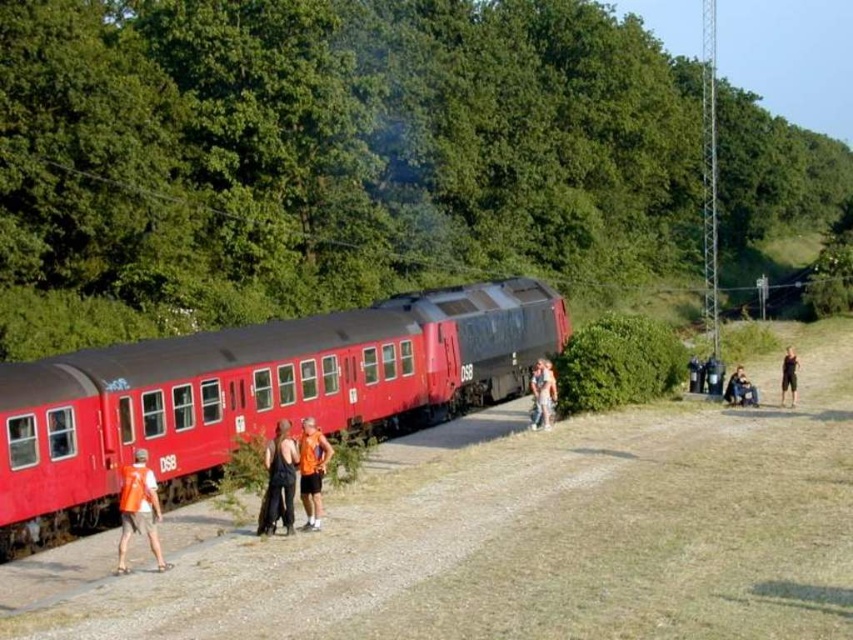
Question: Among these objects, which one is nearest to the camera?

Choices:
 (A) orange fabric shorts at center
 (B) matte red train at center
 (C) dirt track at lower left
 (D) black fabric shorts at right

Answer: (C)

Question: Is dirt track at lower left above matte black tank top at center?

Choices:
 (A) yes
 (B) no

Answer: (B)

Question: Estimate the real-world distances between objects in this image. Which object is farther from the dirt track at lower left?

Choices:
 (A) black fabric shorts at right
 (B) orange fabric shorts at center

Answer: (A)

Question: Is orange reflective vest at lower left to the right of matte black tank top at center from the viewer's perspective?

Choices:
 (A) yes
 (B) no

Answer: (B)

Question: Which point is farther to the camera?

Choices:
 (A) (277, 448)
 (B) (397, 477)
 (C) (788, 364)

Answer: (C)

Question: Does dirt track at lower left have a lesser width compared to orange sleeveless shirt at center?

Choices:
 (A) no
 (B) yes

Answer: (A)